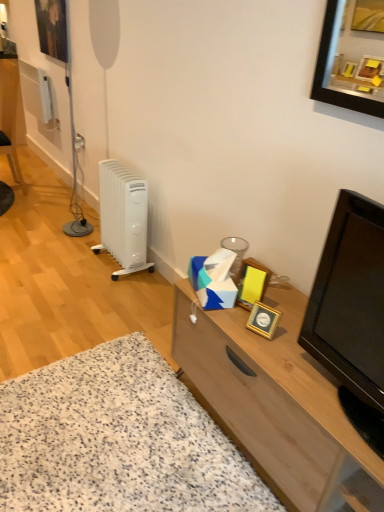
Question: From their relative heights in the image, would you say wooden cabinet at lower right is taller or shorter than gold metallic picture frame at center-right, the second picture frame in the left-to-right sequence?

Choices:
 (A) short
 (B) tall

Answer: (A)

Question: Considering the positions of wooden cabinet at lower right and gold metallic picture frame at center-right, the second picture frame when ordered from right to left, in the image, is wooden cabinet at lower right wider or thinner than gold metallic picture frame at center-right, the second picture frame when ordered from right to left,?

Choices:
 (A) wide
 (B) thin

Answer: (A)

Question: Which is nearer to the gold metallic picture frame at center-right, marked as the third picture frame in a back-to-front arrangement?

Choices:
 (A) wooden cabinet at center
 (B) white plastic radiator at left
 (C) wooden cabinet at lower right
 (D) black glossy television at right
 (E) gold metallic picture frame at center-right, the second picture frame from the back

Answer: (E)

Question: Considering the real-world distances, which object is closest to the black glossy television at right?

Choices:
 (A) gold metallic picture frame at center-right, the second picture frame viewed from the front
 (B) matte black picture frame at upper left, the first picture frame when ordered from back to front
 (C) wooden cabinet at lower right
 (D) gold metallic picture frame at center-right, the 1th picture frame viewed from the front
 (E) white plastic radiator at left

Answer: (D)